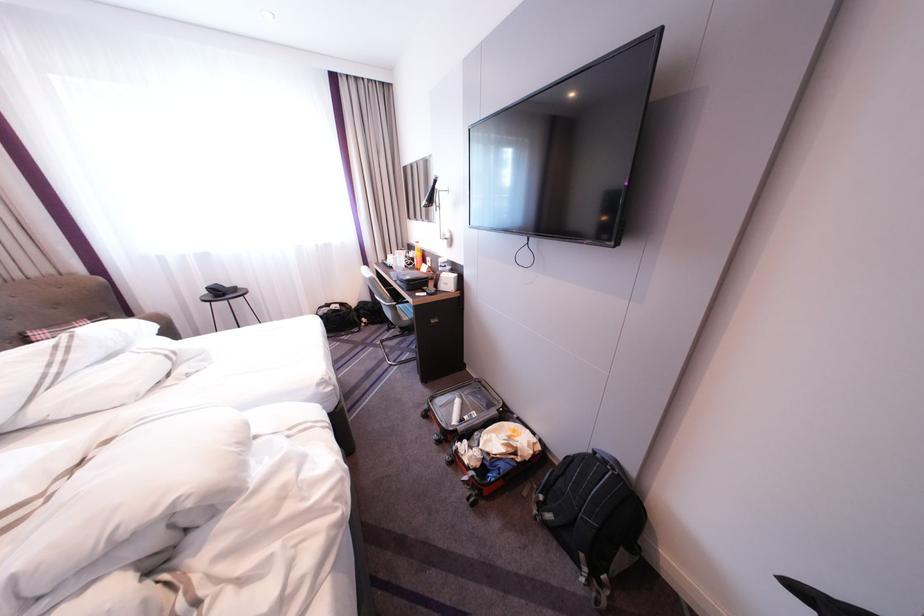
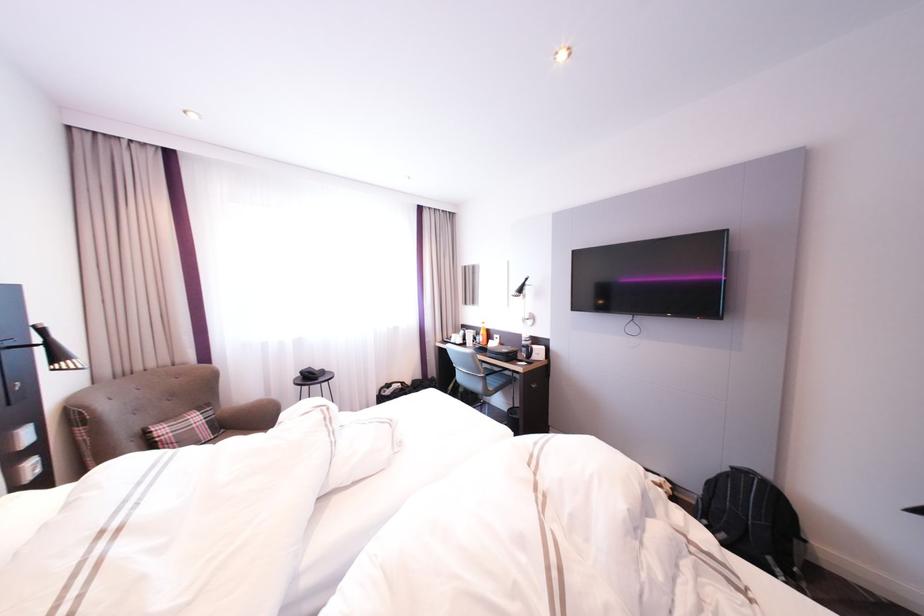
Find the pixel in the second image that matches point (339, 306) in the first image.

(400, 386)